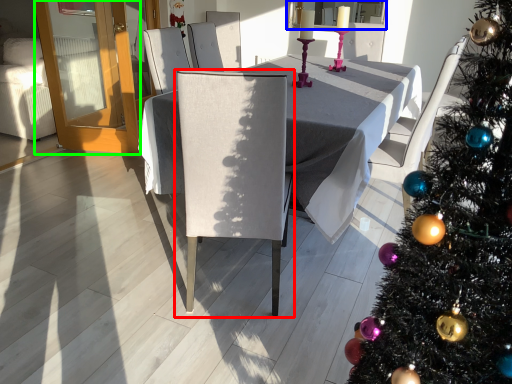
Question: Which object is the farthest from chair (highlighted by a red box)? Choose among these: window screen (highlighted by a blue box) or glass door (highlighted by a green box).

Choices:
 (A) window screen
 (B) glass door

Answer: (A)